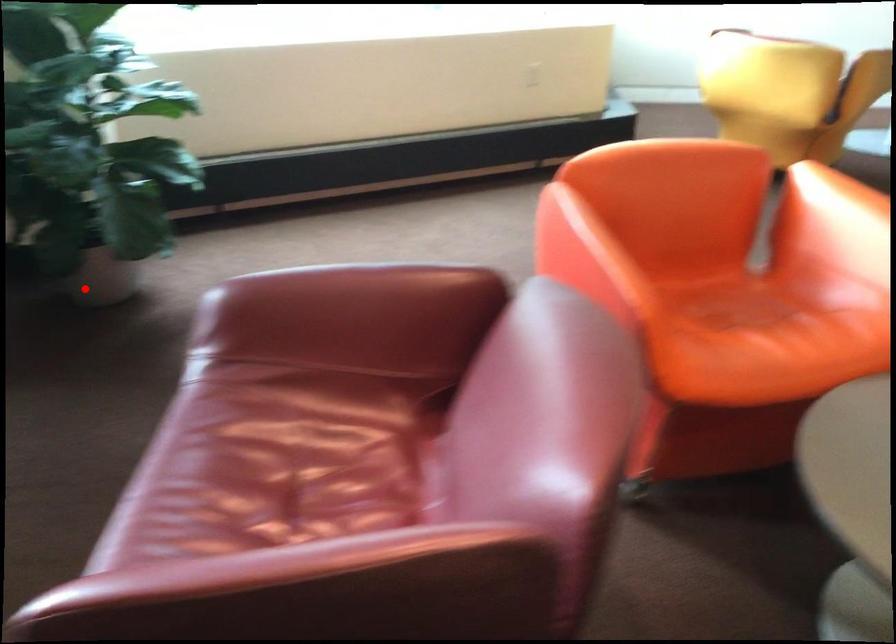
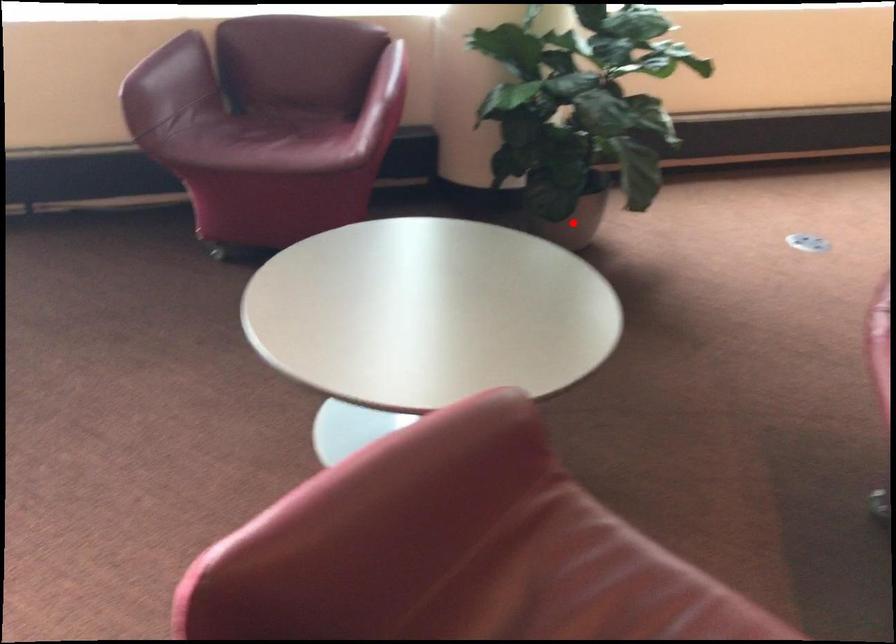
I am providing you with two images of the same scene from different viewpoints. A red point is marked on the first image and another point is marked on the second image. Is the red point in image1 aligned with the point shown in image2?

Yes